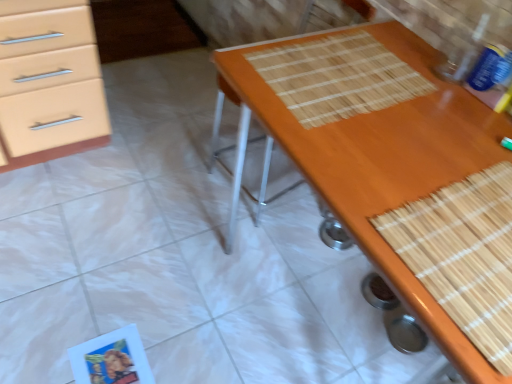
At what (x,y) coordinates should I click in order to perform the action: click on vacant space underneath wooden desk at center (from a real-world perspective). Please return your answer as a coordinate pair (x, y). This screenshot has width=512, height=384. Looking at the image, I should click on (316, 302).